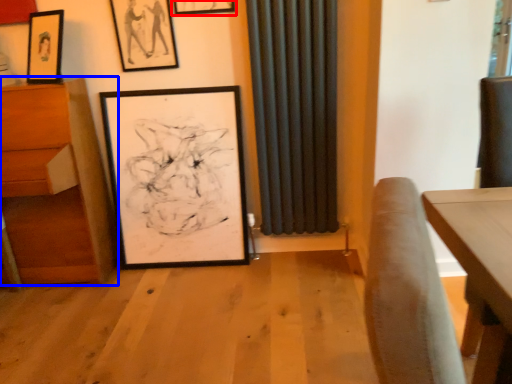
Question: Among these objects, which one is farthest to the camera, picture frame (highlighted by a red box) or furniture (highlighted by a blue box)?

Choices:
 (A) picture frame
 (B) furniture

Answer: (A)